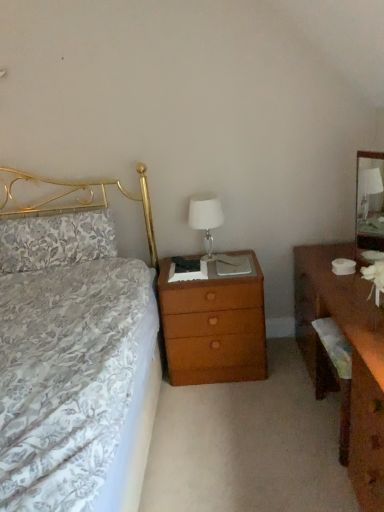
Question: Relative to floral fabric pillow at left, is clear glass mirror at right in front or behind?

Choices:
 (A) behind
 (B) front

Answer: (B)

Question: From a real-world perspective, relative to floral fabric pillow at left, is clear glass mirror at right vertically above or below?

Choices:
 (A) above
 (B) below

Answer: (A)

Question: Which object is positioned closest to the floral fabric pillow at left?

Choices:
 (A) wooden desk at right
 (B) white glass lampshade at center
 (C) brown wood nightstand at center
 (D) clear glass mirror at right

Answer: (C)

Question: Considering the real-world distances, which object is closest to the clear glass mirror at right?

Choices:
 (A) brown wood nightstand at center
 (B) floral fabric pillow at left
 (C) wooden desk at right
 (D) white glass lampshade at center

Answer: (C)